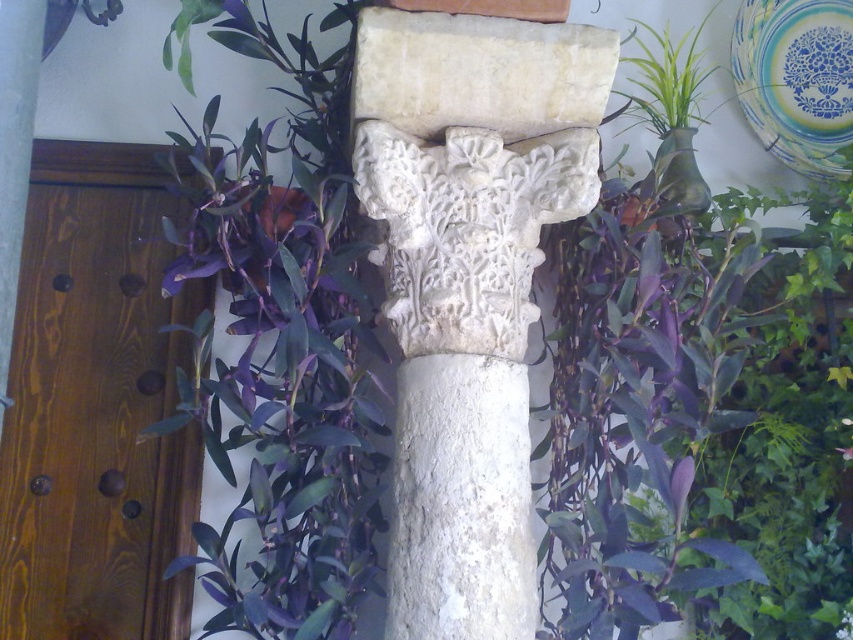
Question: Which of the following is the closest to the observer?

Choices:
 (A) purple leafy plant at center
 (B) white stone column at center

Answer: (B)

Question: Is white stone column at center in front of purple leafy plant at center?

Choices:
 (A) yes
 (B) no

Answer: (A)

Question: Can you confirm if white stone column at center is smaller than purple leafy plant at center?

Choices:
 (A) no
 (B) yes

Answer: (B)

Question: Does white stone column at center appear on the left side of purple leafy plant at center?

Choices:
 (A) no
 (B) yes

Answer: (A)

Question: Among these points, which one is farthest from the camera?

Choices:
 (A) pos(343,508)
 (B) pos(395,276)

Answer: (B)

Question: Which of the following is the farthest from the observer?

Choices:
 (A) white stone column at center
 (B) purple leafy plant at center

Answer: (B)